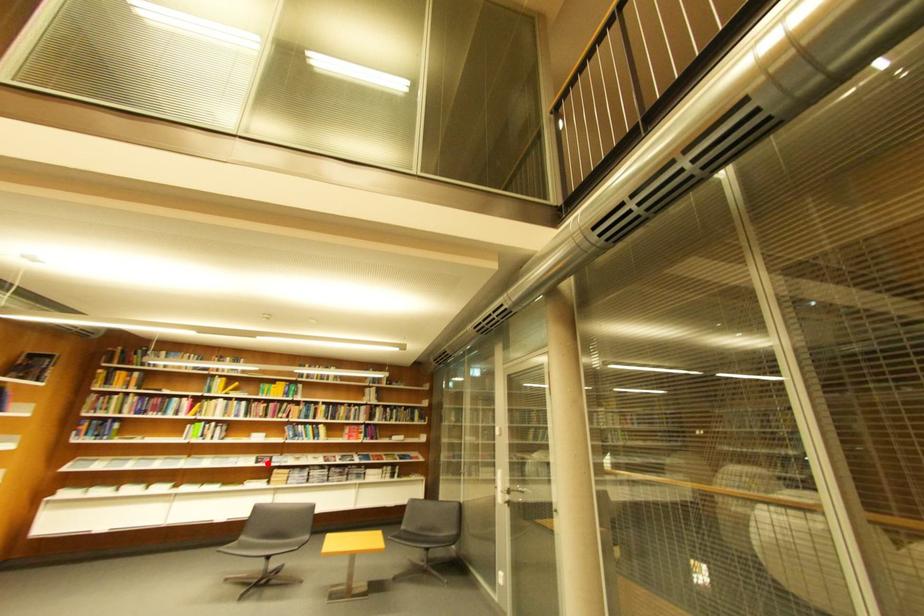
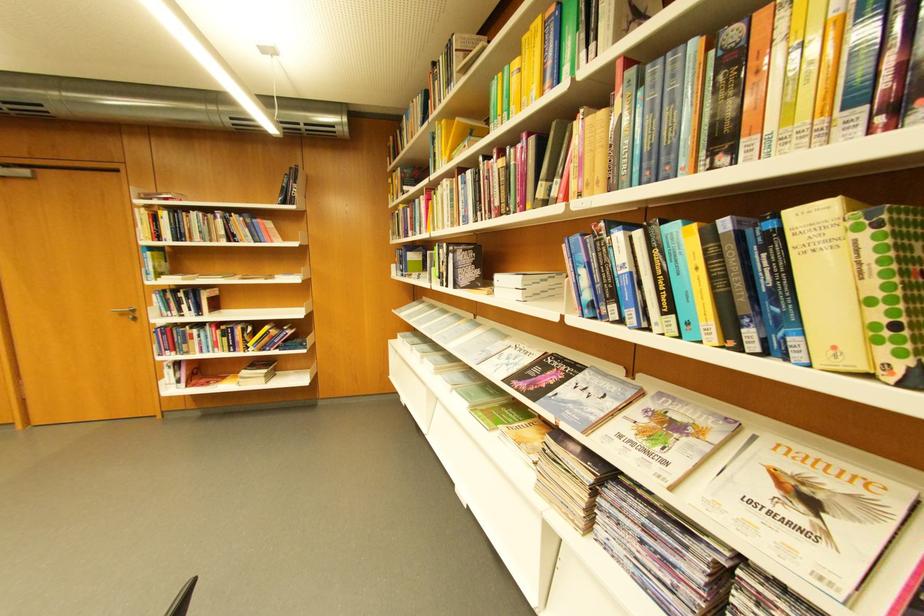
Question: I am providing you with two images of the same scene from different viewpoints. A red point is marked on the first image. At the location where the point appears in image 1, is it still visible in image 2?

Choices:
 (A) Yes
 (B) No

Answer: (A)